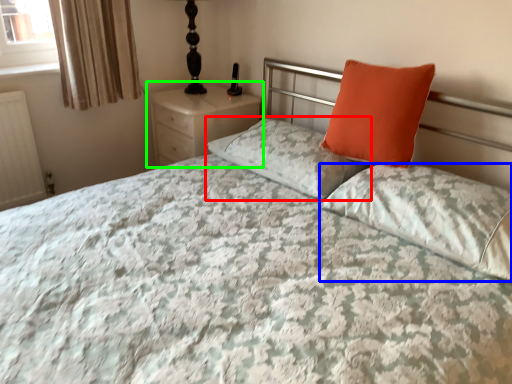
Question: Estimate the real-world distances between objects in this image. Which object is farther from pillow (highlighted by a red box), pillow (highlighted by a blue box) or nightstand (highlighted by a green box)?

Choices:
 (A) pillow
 (B) nightstand

Answer: (B)